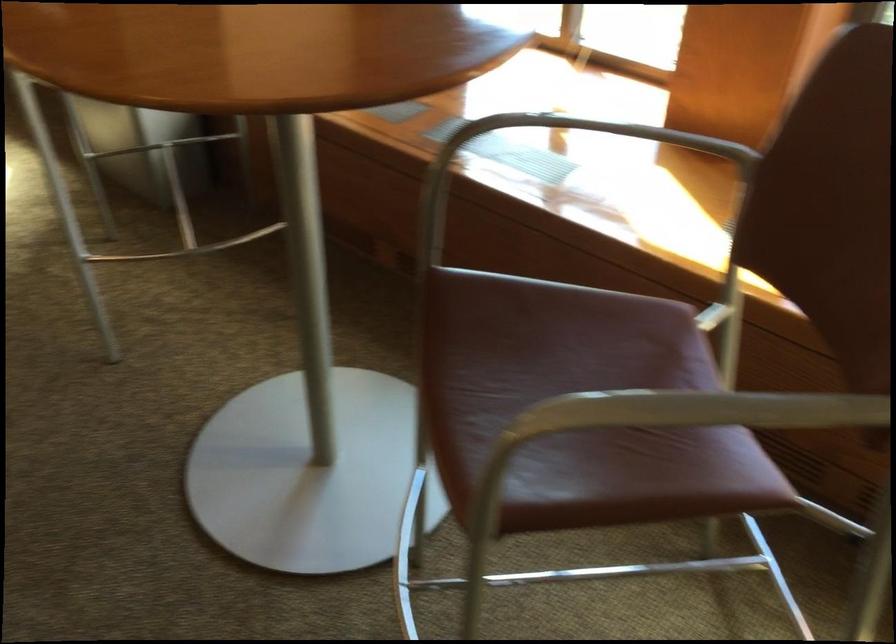
The width and height of the screenshot is (896, 644). Describe the element at coordinates (576, 404) in the screenshot. I see `the chair sitting surface` at that location.